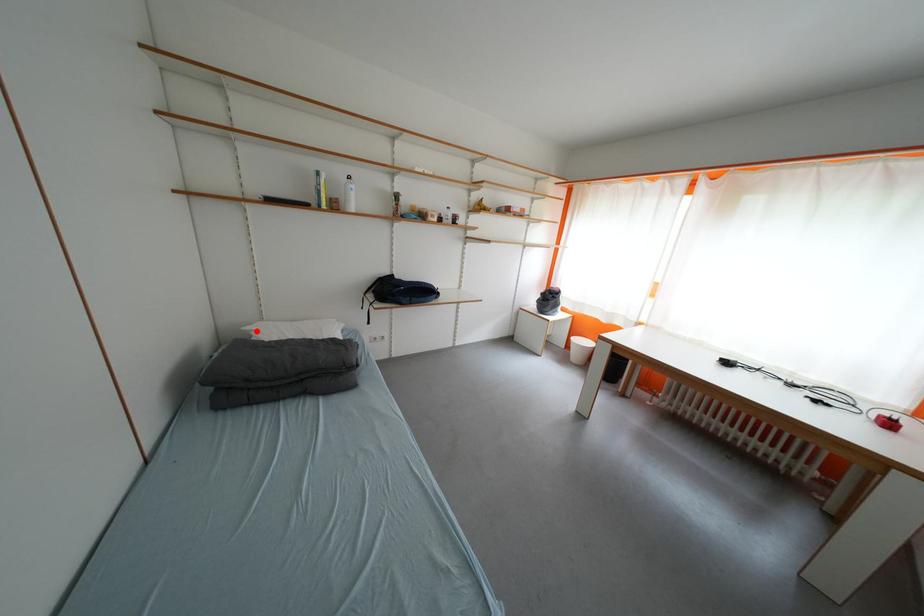
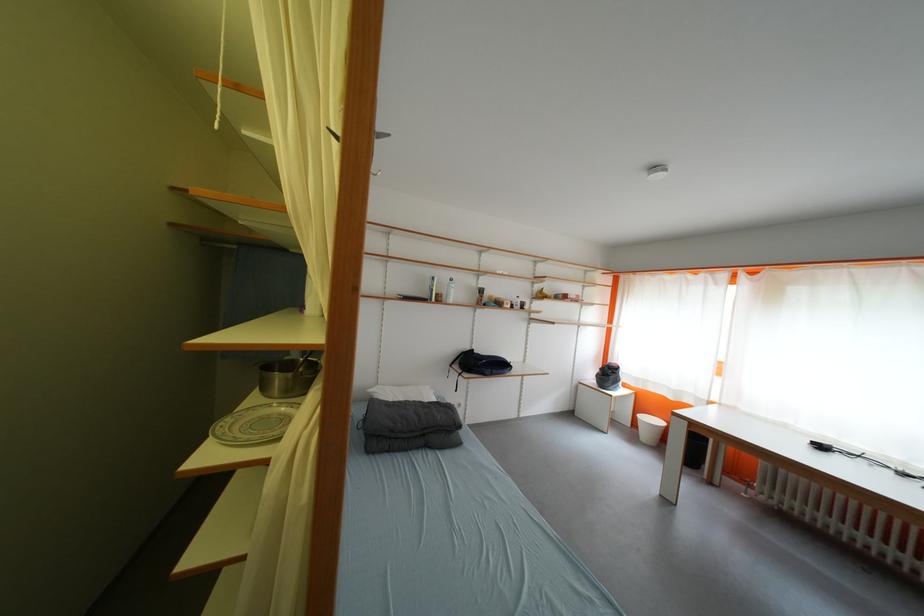
In the second image, find the point that corresponds to the highlighted location in the first image.

(380, 392)